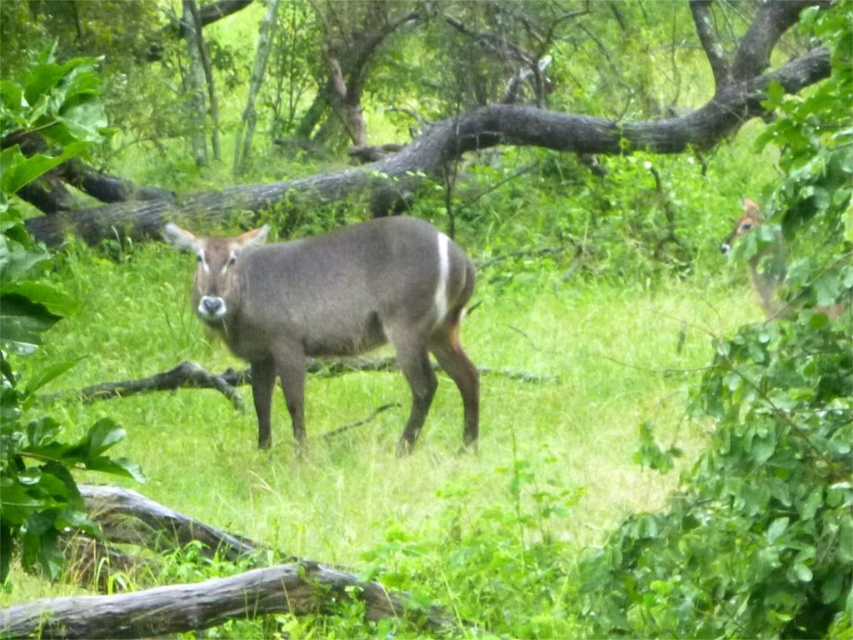
Question: Which object appears closest to the camera in this image?

Choices:
 (A) brown velvet deer at upper right
 (B) green leafy tree at center
 (C) gray matte deer at center

Answer: (C)

Question: Which point is closer to the camera?

Choices:
 (A) brown velvet deer at upper right
 (B) gray matte deer at center

Answer: (B)

Question: Which of the following is the farthest from the observer?

Choices:
 (A) (775, 272)
 (B) (811, 61)

Answer: (B)

Question: Does gray matte deer at center appear on the left side of brown velvet deer at upper right?

Choices:
 (A) no
 (B) yes

Answer: (B)

Question: Is gray matte deer at center above brown velvet deer at upper right?

Choices:
 (A) no
 (B) yes

Answer: (A)

Question: Is gray matte deer at center thinner than brown velvet deer at upper right?

Choices:
 (A) yes
 (B) no

Answer: (B)